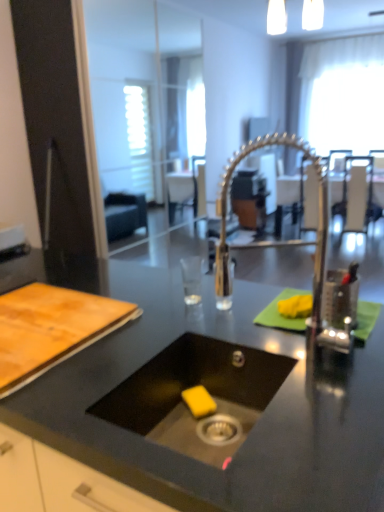
Where is `spots to the right of polished metallic faucet at center`? The image size is (384, 512). spots to the right of polished metallic faucet at center is located at coordinates [348, 362].